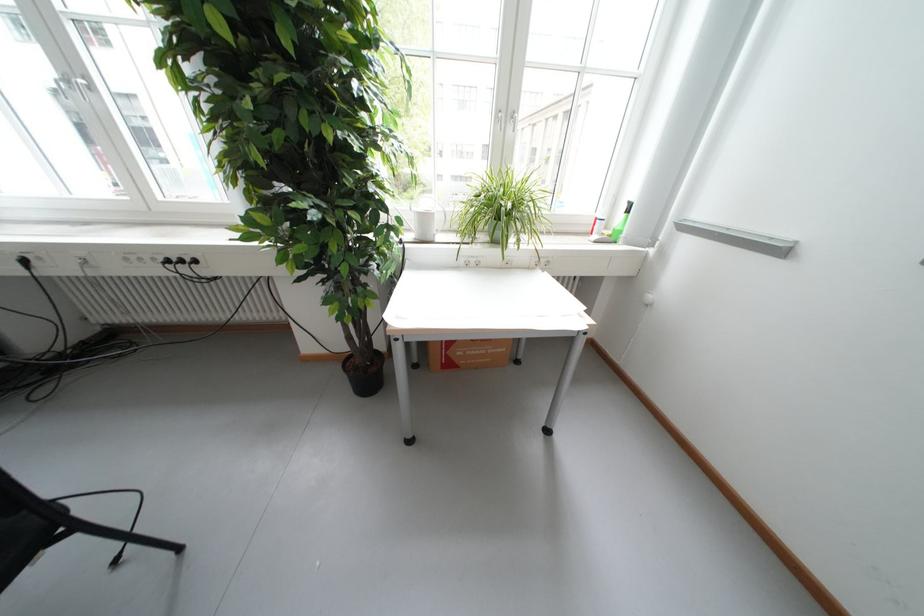
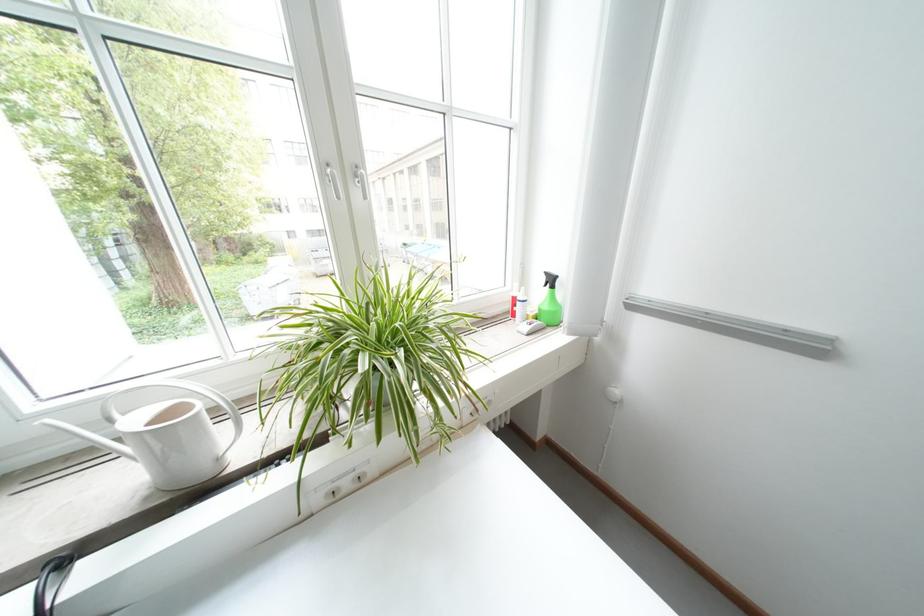
Find the pixel in the second image that matches (638,204) in the first image.

(555, 275)